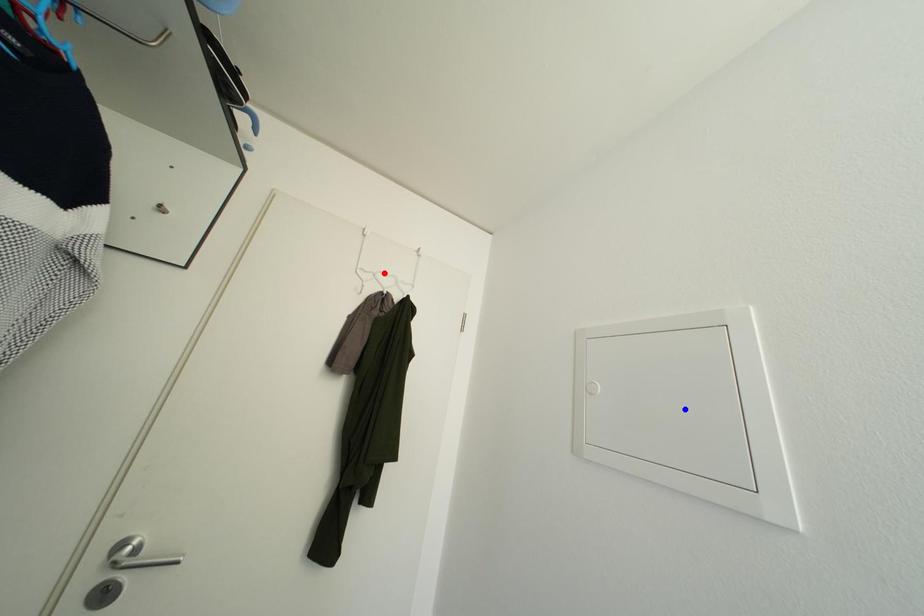
Question: Which of the two points in the image is closer to the camera?

Choices:
 (A) Blue point is closer.
 (B) Red point is closer.

Answer: (A)